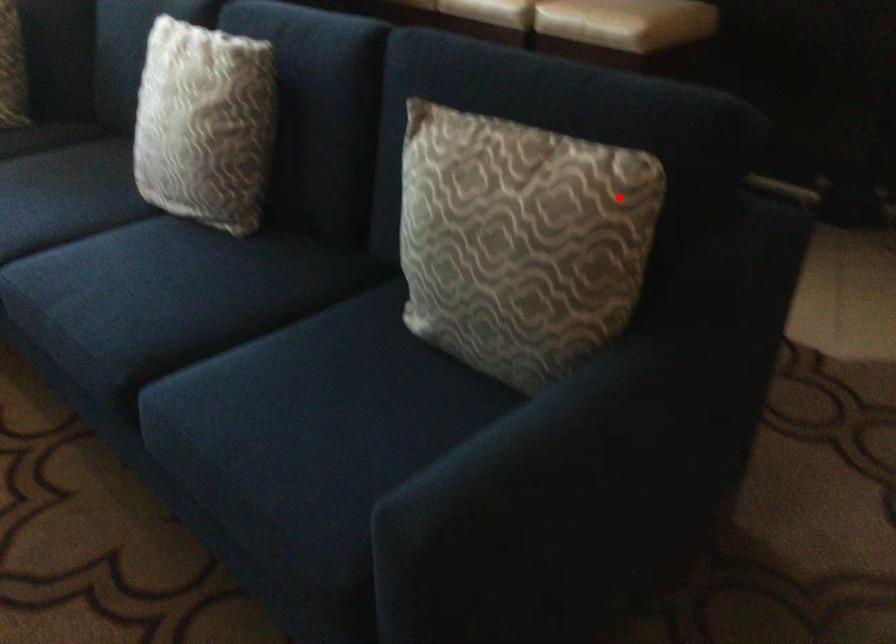
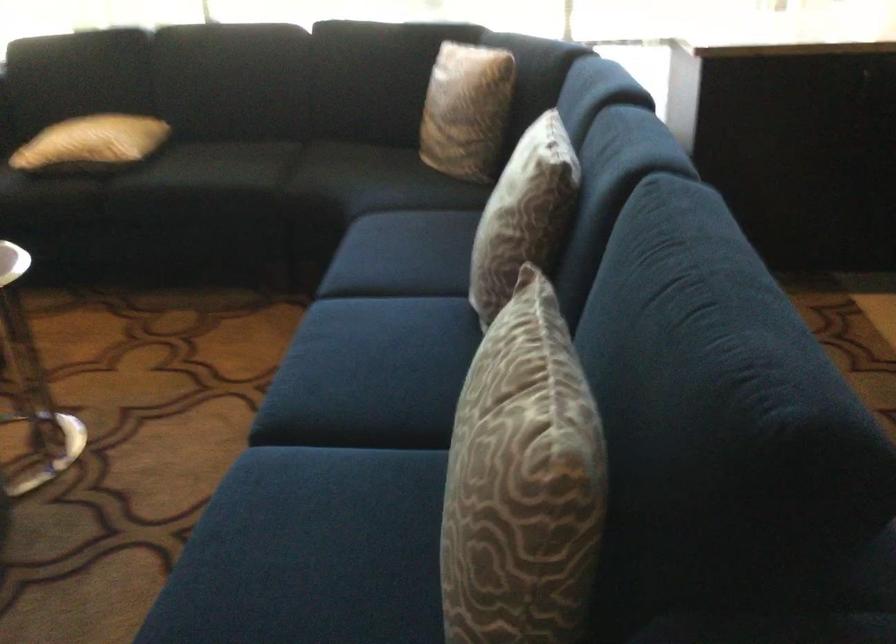
Question: I am providing you with two images of the same scene from different viewpoints. Given a red point in image1, look at the same physical point in image2. Is it:

Choices:
 (A) Closer to the viewpoint
 (B) Farther from the viewpoint

Answer: (A)